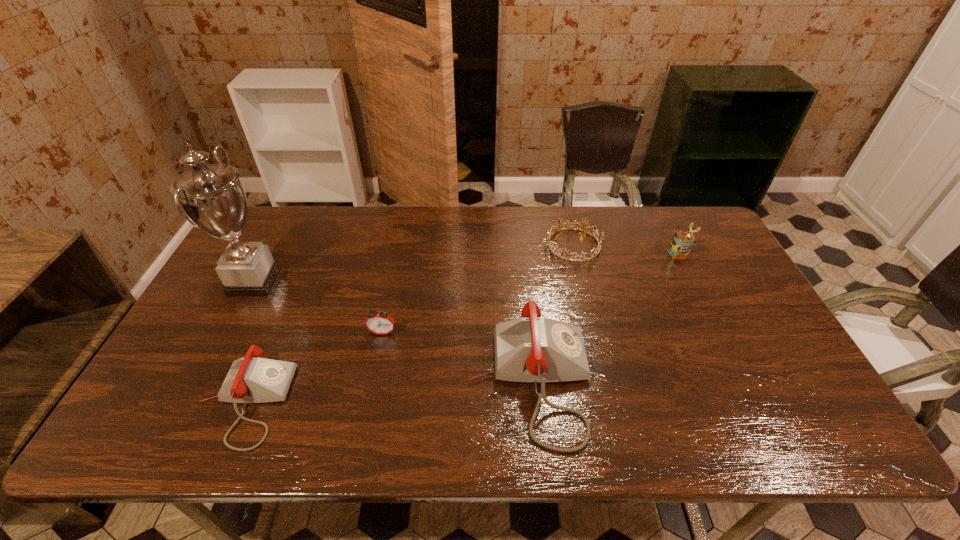
Find the location of a particular element. This screenshot has height=540, width=960. free point that keeps the telephones evenly spaced on the right is located at coordinates (794, 362).